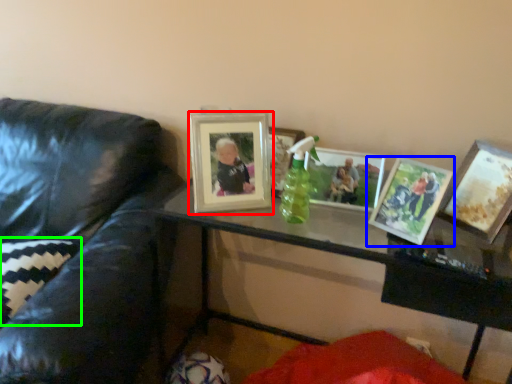
Question: Which object is the farthest from picture frame (highlighted by a red box)? Choose among these: picture frame (highlighted by a blue box) or pillow (highlighted by a green box).

Choices:
 (A) picture frame
 (B) pillow

Answer: (B)